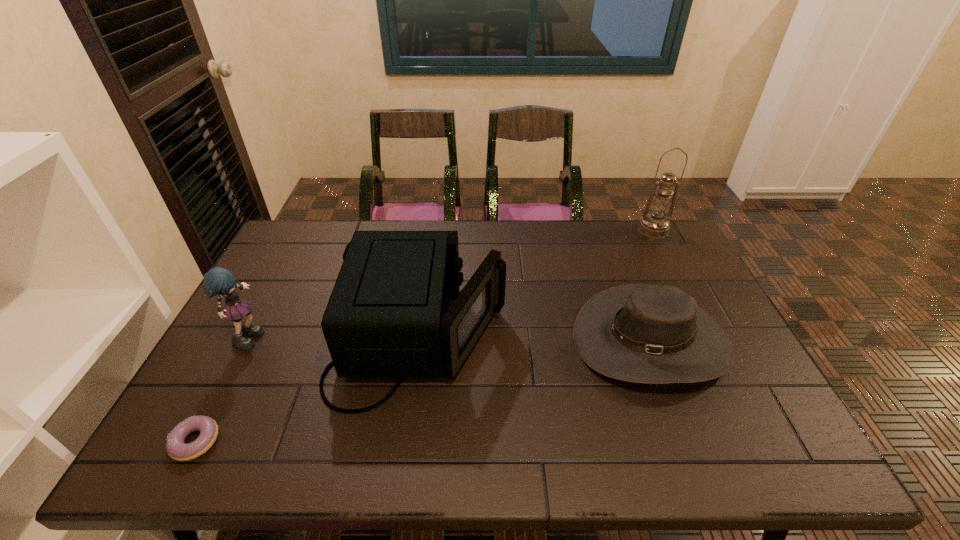
Where is `object located in the far right corner section of the desktop`? This screenshot has height=540, width=960. object located in the far right corner section of the desktop is located at coordinates (655, 225).

In the image, there is a desktop. In order to click on vacant region at the far edge in this screenshot , I will do `click(342, 231)`.

Where is `vacant space at the near edge of the desktop`? The height and width of the screenshot is (540, 960). vacant space at the near edge of the desktop is located at coordinates (666, 445).

In the image, there is a desktop. At what (x,y) coordinates should I click in order to perform the action: click on vacant area at the left edge. Please return your answer as a coordinate pair (x, y). This screenshot has width=960, height=540. Looking at the image, I should click on (236, 396).

In the image, there is a desktop. Identify the location of free region at the right edge. (723, 379).

Find the location of a particular element. The image size is (960, 540). free space between the nearest object and the microwave oven is located at coordinates (308, 389).

Find the location of a particular element. Image resolution: width=960 pixels, height=540 pixels. free space that is in between the fourth tallest object and the third tallest object is located at coordinates (535, 340).

You are a GUI agent. You are given a task and a screenshot of the screen. Output one action in this format:
    pyautogui.click(x=<x>, y=<y>)
    Task: Click on the vacant space that's between the rag doll and the shortest object
    
    Given the screenshot: What is the action you would take?
    pyautogui.click(x=223, y=388)

Select which object appears as the second closest to the second shortest object. Please provide its 2D coordinates. Your answer should be formatted as a tuple, i.e. [(x, y)], where the tuple contains the x and y coordinates of a point satisfying the conditions above.

[(655, 225)]

Where is `object that ranks as the fourth closest to the microwave oven`? The width and height of the screenshot is (960, 540). object that ranks as the fourth closest to the microwave oven is located at coordinates (655, 225).